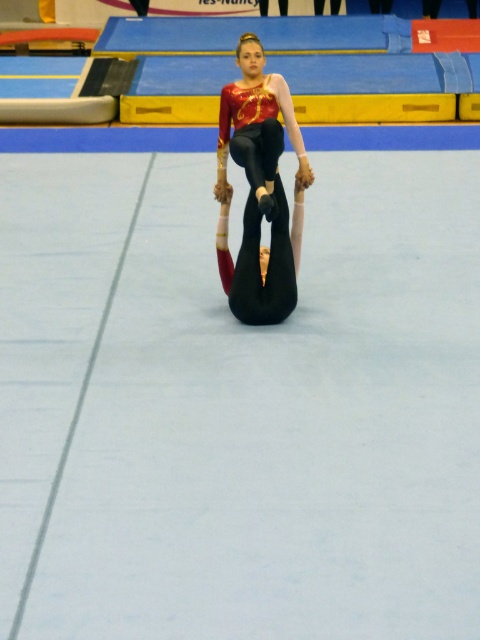
You are a judge observing the gymnastics routine. You notice two athletes at the center of the mat. Which athlete is positioned higher in the air between the shiny red leotard at center and the black matte gymnast at center?

The shiny red leotard at center is positioned higher in the air compared to the black matte gymnast at center, as stated in the description.

Looking at the gymnastics scene, where is the shiny red leotard at center relative to the black matte gymnast at center?

The shiny red leotard at center is to the right of the black matte gymnast at center.

You are a judge observing the gymnastics routine. You notice the shiny red leotard at center and the black matte gymnast at center. Which athlete is wearing the larger leotard?

The shiny red leotard at center has a larger size compared to the black matte gymnast at center, so the athlete wearing the shiny red leotard at center is the one with the larger leotard.